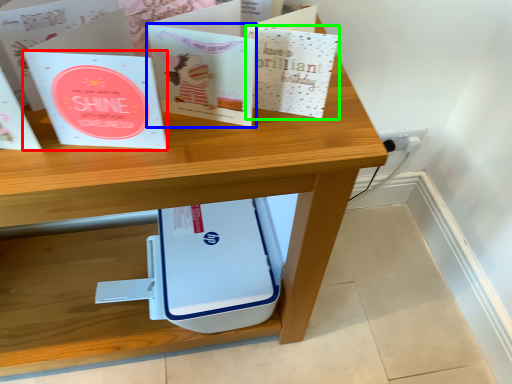
Question: Which is farther away from paperback book (highlighted by a red box)? paperback book (highlighted by a blue box) or paperback book (highlighted by a green box)?

Choices:
 (A) paperback book
 (B) paperback book

Answer: (B)